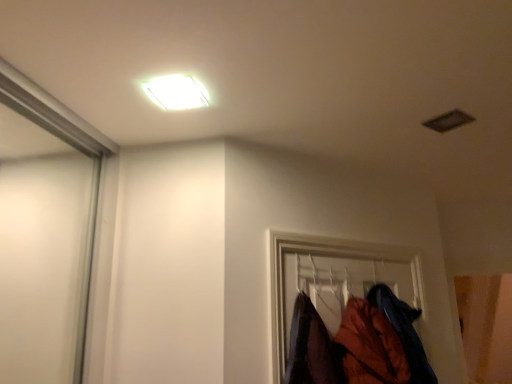
You are a GUI agent. You are given a task and a screenshot of the screen. Output one action in this format:
    pyautogui.click(x=<x>, y=<y>)
    Task: Click on the orange fabric coat at lower right, placed as the 1th clothing when sorted from right to left
    The height and width of the screenshot is (384, 512).
    Given the screenshot: What is the action you would take?
    pyautogui.click(x=404, y=331)

Where is `velvet-like orange coat at lower right, which is the second clothing in right-to-left order`? The width and height of the screenshot is (512, 384). velvet-like orange coat at lower right, which is the second clothing in right-to-left order is located at coordinates (370, 346).

Locate an element on the screen. The image size is (512, 384). orange fabric coat at lower right, placed as the 1th clothing when sorted from right to left is located at coordinates (404, 331).

Is velvet-like orange coat at lower right, which is the first clothing from left to right, facing away from white glossy light fixture at upper center?

That's not correct — velvet-like orange coat at lower right, which is the first clothing from left to right, is not looking away from white glossy light fixture at upper center.

Is velvet-like orange coat at lower right, which is the second clothing in right-to-left order, taller than white glossy light fixture at upper center?

Yes.

Considering the positions of objects velvet-like orange coat at lower right, which is the first clothing from left to right, and white glossy light fixture at upper center in the image provided, who is more to the left, velvet-like orange coat at lower right, which is the first clothing from left to right, or white glossy light fixture at upper center?

white glossy light fixture at upper center.

Looking at this image, which of these two, velvet-like orange coat at lower right, which is the second clothing in right-to-left order, or white glossy light fixture at upper center, is smaller?

white glossy light fixture at upper center.

Is point (376, 293) closer or farther from the camera than point (369, 338)?

Point (376, 293) appears to be farther away from the viewer than point (369, 338).

From the image's perspective, does orange fabric coat at lower right, which is counted as the 2th clothing, starting from the left, appear lower than velvet-like orange coat at lower right, which is the first clothing from left to right?

Yes, from the image's perspective, orange fabric coat at lower right, which is counted as the 2th clothing, starting from the left, is beneath velvet-like orange coat at lower right, which is the first clothing from left to right.

Considering the positions of objects orange fabric coat at lower right, placed as the 1th clothing when sorted from right to left, and velvet-like orange coat at lower right, which is the first clothing from left to right, in the image provided, who is more to the right, orange fabric coat at lower right, placed as the 1th clothing when sorted from right to left, or velvet-like orange coat at lower right, which is the first clothing from left to right,?

From the viewer's perspective, orange fabric coat at lower right, placed as the 1th clothing when sorted from right to left, appears more on the right side.

Considering the relative sizes of orange fabric coat at lower right, which is counted as the 2th clothing, starting from the left, and velvet-like orange coat at lower right, which is the first clothing from left to right, in the image provided, is orange fabric coat at lower right, which is counted as the 2th clothing, starting from the left, wider than velvet-like orange coat at lower right, which is the first clothing from left to right,?

In fact, orange fabric coat at lower right, which is counted as the 2th clothing, starting from the left, might be narrower than velvet-like orange coat at lower right, which is the first clothing from left to right.

Identify the location of clothing above the velvet-like orange coat at lower right, which is the first clothing from left to right (from a real-world perspective). This screenshot has width=512, height=384. (404, 331).

Is velvet-like orange coat at lower right, which is the first clothing from left to right, inside the boundaries of orange fabric coat at lower right, placed as the 1th clothing when sorted from right to left, or outside?

velvet-like orange coat at lower right, which is the first clothing from left to right, cannot be found inside orange fabric coat at lower right, placed as the 1th clothing when sorted from right to left.

Looking at the image, does velvet-like orange coat at lower right, which is the second clothing in right-to-left order, seem bigger or smaller compared to orange fabric coat at lower right, placed as the 1th clothing when sorted from right to left?

In the image, velvet-like orange coat at lower right, which is the second clothing in right-to-left order, appears to be smaller than orange fabric coat at lower right, placed as the 1th clothing when sorted from right to left.

Looking at this image, are velvet-like orange coat at lower right, which is the second clothing in right-to-left order, and orange fabric coat at lower right, placed as the 1th clothing when sorted from right to left, beside each other?

No.

Measure the distance from white glossy light fixture at upper center to velvet-like orange coat at lower right, which is the second clothing in right-to-left order.

white glossy light fixture at upper center and velvet-like orange coat at lower right, which is the second clothing in right-to-left order, are 3.54 feet apart.

You are a GUI agent. You are given a task and a screenshot of the screen. Output one action in this format:
    pyautogui.click(x=<x>, y=<y>)
    Task: Click on the lamp in front of the velvet-like orange coat at lower right, which is the second clothing in right-to-left order
    
    Given the screenshot: What is the action you would take?
    pos(177,92)

Visually, is white glossy light fixture at upper center positioned to the left or to the right of velvet-like orange coat at lower right, which is the second clothing in right-to-left order?

From the image, it's evident that white glossy light fixture at upper center is to the left of velvet-like orange coat at lower right, which is the second clothing in right-to-left order.

From the image's perspective, between white glossy light fixture at upper center and velvet-like orange coat at lower right, which is the first clothing from left to right, which one is located above?

white glossy light fixture at upper center, from the image's perspective.

From a real-world perspective, is white glossy light fixture at upper center located higher than orange fabric coat at lower right, placed as the 1th clothing when sorted from right to left?

Yes.

Is white glossy light fixture at upper center placed right next to orange fabric coat at lower right, which is counted as the 2th clothing, starting from the left?

No, white glossy light fixture at upper center is not beside orange fabric coat at lower right, which is counted as the 2th clothing, starting from the left.

Between white glossy light fixture at upper center and orange fabric coat at lower right, which is counted as the 2th clothing, starting from the left, which one has more height?

With more height is orange fabric coat at lower right, which is counted as the 2th clothing, starting from the left.

Does orange fabric coat at lower right, placed as the 1th clothing when sorted from right to left, have a lesser width compared to white glossy light fixture at upper center?

Incorrect, the width of orange fabric coat at lower right, placed as the 1th clothing when sorted from right to left, is not less than that of white glossy light fixture at upper center.

Considering the positions of objects orange fabric coat at lower right, placed as the 1th clothing when sorted from right to left, and white glossy light fixture at upper center in the image provided, who is more to the left, orange fabric coat at lower right, placed as the 1th clothing when sorted from right to left, or white glossy light fixture at upper center?

From the viewer's perspective, white glossy light fixture at upper center appears more on the left side.

From a real-world perspective, does orange fabric coat at lower right, which is counted as the 2th clothing, starting from the left, sit lower than white glossy light fixture at upper center?

Yes, from a real-world perspective, orange fabric coat at lower right, which is counted as the 2th clothing, starting from the left, is under white glossy light fixture at upper center.

From the image's perspective, is orange fabric coat at lower right, placed as the 1th clothing when sorted from right to left, under white glossy light fixture at upper center?

Indeed, from the image's perspective, orange fabric coat at lower right, placed as the 1th clothing when sorted from right to left, is shown beneath white glossy light fixture at upper center.

Where is `lamp in front of the velvet-like orange coat at lower right, which is the first clothing from left to right`? The image size is (512, 384). lamp in front of the velvet-like orange coat at lower right, which is the first clothing from left to right is located at coordinates (177, 92).

Find the location of a particular element. This screenshot has height=384, width=512. clothing that appears above the velvet-like orange coat at lower right, which is the second clothing in right-to-left order (from a real-world perspective) is located at coordinates (404, 331).

Based on their spatial positions, is velvet-like orange coat at lower right, which is the second clothing in right-to-left order, or white glossy light fixture at upper center further from orange fabric coat at lower right, placed as the 1th clothing when sorted from right to left?

Based on the image, white glossy light fixture at upper center appears to be further to orange fabric coat at lower right, placed as the 1th clothing when sorted from right to left.

Consider the image. Based on their spatial positions, is white glossy light fixture at upper center or velvet-like orange coat at lower right, which is the second clothing in right-to-left order, closer to orange fabric coat at lower right, placed as the 1th clothing when sorted from right to left?

Based on the image, velvet-like orange coat at lower right, which is the second clothing in right-to-left order, appears to be nearer to orange fabric coat at lower right, placed as the 1th clothing when sorted from right to left.

When comparing their distances from white glossy light fixture at upper center, does orange fabric coat at lower right, which is counted as the 2th clothing, starting from the left, or velvet-like orange coat at lower right, which is the second clothing in right-to-left order, seem further?

orange fabric coat at lower right, which is counted as the 2th clothing, starting from the left.

From the image, which object appears to be nearer to velvet-like orange coat at lower right, which is the second clothing in right-to-left order, white glossy light fixture at upper center or orange fabric coat at lower right, which is counted as the 2th clothing, starting from the left?

Based on the image, orange fabric coat at lower right, which is counted as the 2th clothing, starting from the left, appears to be nearer to velvet-like orange coat at lower right, which is the second clothing in right-to-left order.

Considering their positions, is orange fabric coat at lower right, which is counted as the 2th clothing, starting from the left, positioned closer to velvet-like orange coat at lower right, which is the first clothing from left to right, than white glossy light fixture at upper center?

orange fabric coat at lower right, which is counted as the 2th clothing, starting from the left, lies closer to velvet-like orange coat at lower right, which is the first clothing from left to right, than the other object.

Based on their spatial positions, is velvet-like orange coat at lower right, which is the second clothing in right-to-left order, or orange fabric coat at lower right, which is counted as the 2th clothing, starting from the left, closer to white glossy light fixture at upper center?

velvet-like orange coat at lower right, which is the second clothing in right-to-left order.

The height and width of the screenshot is (384, 512). I want to click on clothing that lies between white glossy light fixture at upper center and orange fabric coat at lower right, placed as the 1th clothing when sorted from right to left, from top to bottom, so click(x=370, y=346).